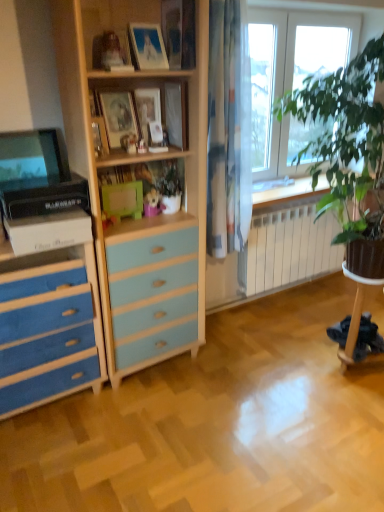
Question: From a real-world perspective, is matte black monitor at left under blue painted wood chest of drawers at left?

Choices:
 (A) no
 (B) yes

Answer: (A)

Question: Is matte black monitor at left thinner than blue painted wood chest of drawers at left?

Choices:
 (A) yes
 (B) no

Answer: (A)

Question: Considering the relative sizes of matte black monitor at left and blue painted wood chest of drawers at left in the image provided, is matte black monitor at left taller than blue painted wood chest of drawers at left?

Choices:
 (A) no
 (B) yes

Answer: (A)

Question: Can you confirm if matte black monitor at left is bigger than blue painted wood chest of drawers at left?

Choices:
 (A) no
 (B) yes

Answer: (A)

Question: Is matte black monitor at left closer to the viewer compared to blue painted wood chest of drawers at left?

Choices:
 (A) no
 (B) yes

Answer: (A)

Question: Does point (51, 175) appear closer or farther from the camera than point (135, 96)?

Choices:
 (A) closer
 (B) farther

Answer: (A)

Question: Is matte black monitor at left wider or thinner than matte wooden picture frame at center, which is counted as the 1th picture frame, starting from the back?

Choices:
 (A) thin
 (B) wide

Answer: (B)

Question: Choose the correct answer: Is matte black monitor at left inside matte wooden picture frame at center, which ranks as the 3th picture frame in front-to-back order, or outside it?

Choices:
 (A) inside
 (B) outside

Answer: (B)

Question: Is matte black monitor at left taller or shorter than matte wooden picture frame at center, which ranks as the 3th picture frame in front-to-back order?

Choices:
 (A) short
 (B) tall

Answer: (B)

Question: From a real-world perspective, is matte wooden picture frame at upper center, which ranks as the 2th picture frame in front-to-back order, physically located above or below matte black monitor at left?

Choices:
 (A) below
 (B) above

Answer: (B)

Question: Considering the relative positions of matte wooden picture frame at upper center, which ranks as the 2th picture frame in front-to-back order, and matte black monitor at left in the image provided, is matte wooden picture frame at upper center, which ranks as the 2th picture frame in front-to-back order, to the left or to the right of matte black monitor at left?

Choices:
 (A) left
 (B) right

Answer: (B)

Question: From the image's perspective, relative to matte black monitor at left, is matte wooden picture frame at upper center, which ranks as the 2th picture frame in front-to-back order, above or below?

Choices:
 (A) below
 (B) above

Answer: (B)

Question: In terms of width, does matte wooden picture frame at upper center, which ranks as the 2th picture frame in front-to-back order, look wider or thinner when compared to matte black monitor at left?

Choices:
 (A) thin
 (B) wide

Answer: (A)

Question: From the image's perspective, is matte wooden picture frame at center, which ranks as the 3th picture frame in front-to-back order, located above or below wooden picture frames at upper center?

Choices:
 (A) below
 (B) above

Answer: (B)

Question: Considering the positions of matte wooden picture frame at center, which ranks as the 3th picture frame in front-to-back order, and wooden picture frames at upper center in the image, is matte wooden picture frame at center, which ranks as the 3th picture frame in front-to-back order, wider or thinner than wooden picture frames at upper center?

Choices:
 (A) wide
 (B) thin

Answer: (B)